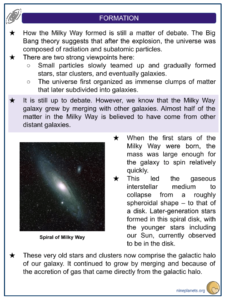
You are a GUI agent. You are given a task and a screenshot of the screen. Output one action in this format:
    pyautogui.click(x=<x>, y=<y>)
    Task: Click on the purple bar
    This screenshot has height=300, width=225.
    Given the screenshot: What is the action you would take?
    pyautogui.click(x=149, y=17)